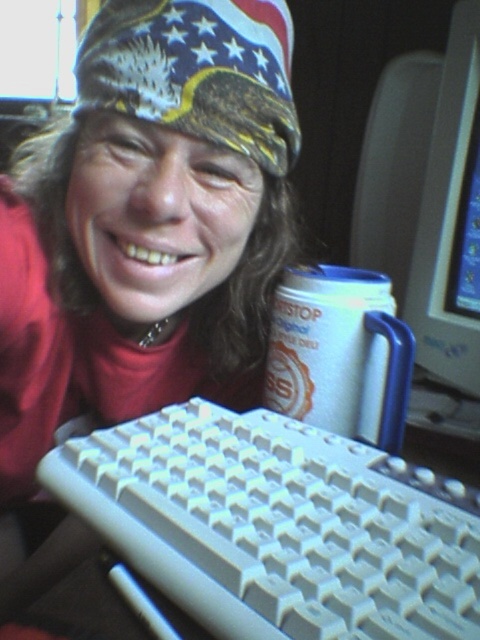
Based on the scene, where is the white plastic keyboard at lower center located in relation to the american flag bandana at upper center?

The white plastic keyboard at lower center is positioned below the american flag bandana at upper center.

You are setting up a desk for a new employee. You have a matte plastic keyboard at lower center and a white paper cup at center. Which object should you place on the desk first to ensure there is enough space for both?

You should place the matte plastic keyboard at lower center first because it has a greater height than the white paper cup at center, so it needs to be positioned to avoid blocking the cup.